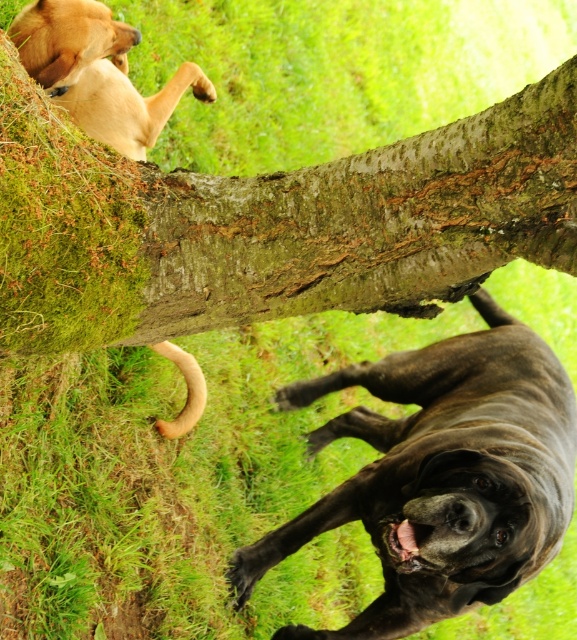
You are a photographer trying to capture a photo of the shiny brown dog at upper center and the green mossy bark at upper center. Since the camera can only focus on one subject at a time, which one should you focus on first if you want to ensure the one closer to the camera is sharp?

The green mossy bark at upper center is located above the shiny brown dog at upper center, so it is closer to the camera. Therefore, you should focus on the green mossy bark at upper center first to ensure it is sharp.

You are a photographer trying to capture both the green mossy bark at upper center and the shiny brown dog at upper center in the same frame. Given their sizes, which one would you need to move closer to the camera to ensure both fit properly?

The green mossy bark at upper center is smaller than the shiny brown dog at upper center. To ensure both fit in the frame, you should move the green mossy bark at upper center closer to the camera since it is smaller and requires less space.

You are a photographer trying to capture a photo of both the green mossy bark at upper center and the golden fur dog at upper left in the same frame. Given their sizes, which one should you focus on to ensure both fit in the frame?

The green mossy bark at upper center is wider than the golden fur dog at upper left, so you should focus on the green mossy bark at upper center to ensure both fit in the frame since it takes up more space.